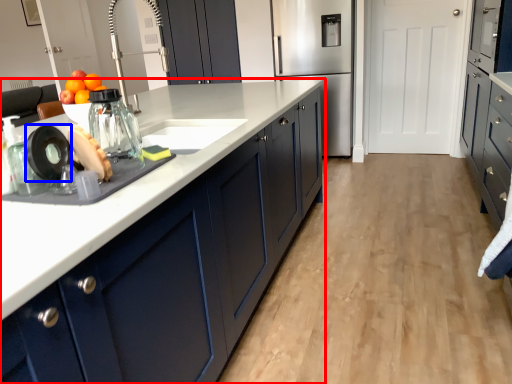
Question: Which object is closer to the camera taking this photo, cabinetry (highlighted by a red box) or appliance (highlighted by a blue box)?

Choices:
 (A) cabinetry
 (B) appliance

Answer: (A)